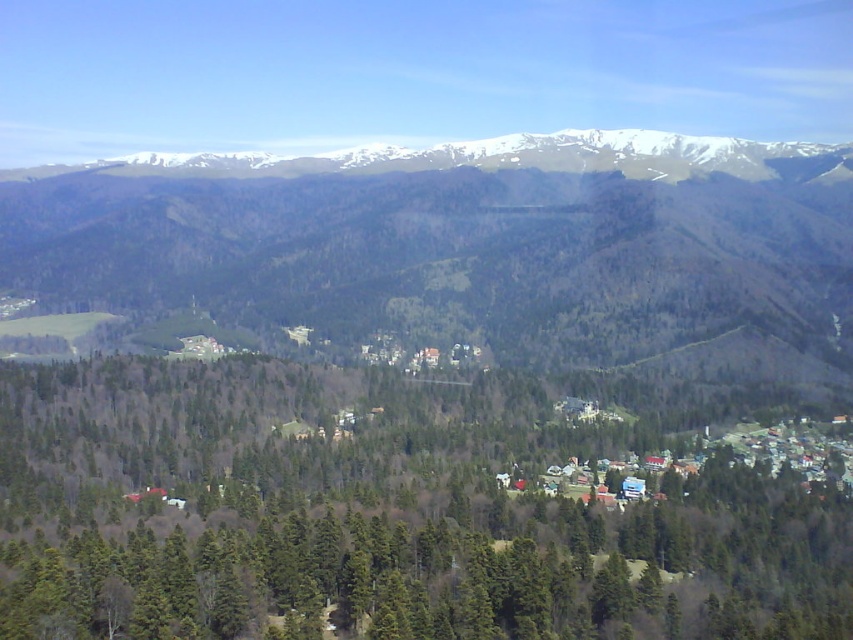
Consider the image. Who is positioned more to the right, green forested mountain range at upper center or snowy rock mountain range at upper center?

snowy rock mountain range at upper center is more to the right.

Does point (628, 218) lie behind point (614, 168)?

No, it is not.

Locate an element on the screen. The image size is (853, 640). green forested mountain range at upper center is located at coordinates (471, 248).

Does green matte trees at center have a greater width compared to snowy rock mountain range at upper center?

No, green matte trees at center is not wider than snowy rock mountain range at upper center.

Which is behind, point (399, 529) or point (148, 172)?

Positioned behind is point (148, 172).

At what (x,y) coordinates should I click in order to perform the action: click on green matte trees at center. Please return your answer as a coordinate pair (x, y). Looking at the image, I should click on (384, 513).

Does green matte trees at center have a greater width compared to green forested mountain range at upper center?

No, green matte trees at center is not wider than green forested mountain range at upper center.

Is green matte trees at center shorter than green forested mountain range at upper center?

Correct, green matte trees at center is not as tall as green forested mountain range at upper center.

Is point (178, 371) farther from camera compared to point (650, 320)?

That is False.

This screenshot has height=640, width=853. In order to click on green matte trees at center in this screenshot , I will do 384,513.